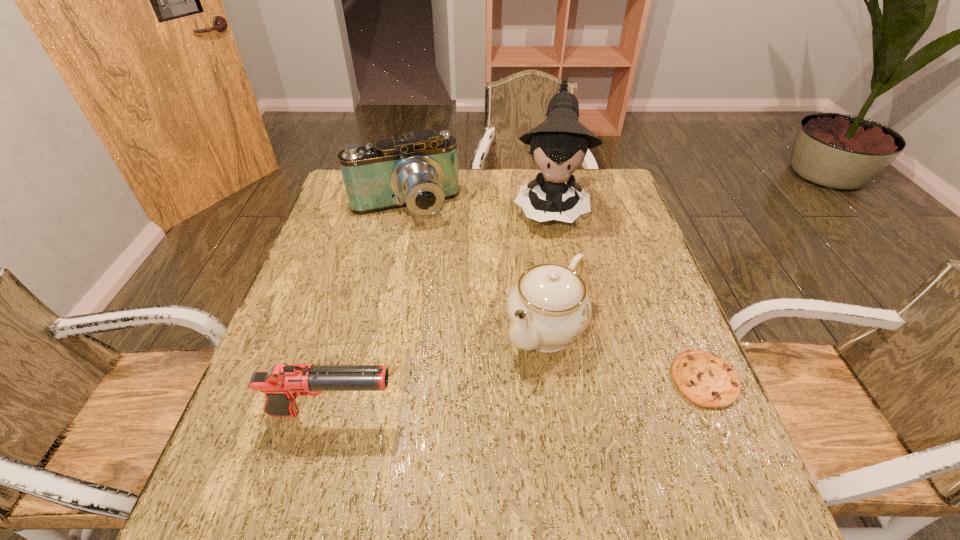
The width and height of the screenshot is (960, 540). I want to click on object that stands as the fourth closest to the cookie, so click(x=419, y=171).

Point out which object is positioned as the fourth nearest to the chinaware. Please provide its 2D coordinates. Your answer should be formatted as a tuple, i.e. [(x, y)], where the tuple contains the x and y coordinates of a point satisfying the conditions above.

[(419, 171)]

At what (x,y) coordinates should I click in order to perform the action: click on free spot that satisfies the following two spatial constraints: 1. on the back side of the chinaware; 2. on the right side of the doll. Please return your answer as a coordinate pair (x, y). The height and width of the screenshot is (540, 960). Looking at the image, I should click on (529, 206).